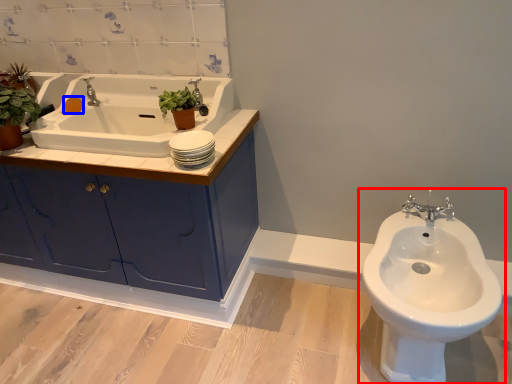
Question: Which of the following is the closest to the observer, toilet (highlighted by a red box) or soap (highlighted by a blue box)?

Choices:
 (A) toilet
 (B) soap

Answer: (A)